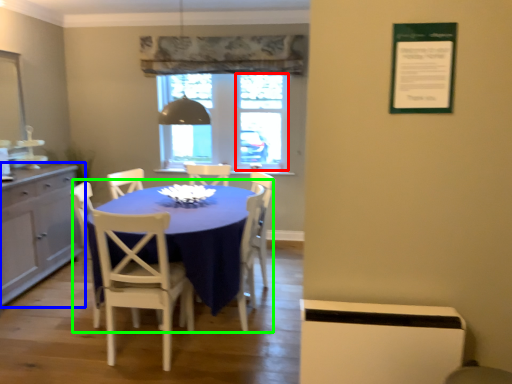
Question: Which object is the closest to the window screen (highlighted by a red box)? Choose among these: cabinetry (highlighted by a blue box) or kitchen & dining room table (highlighted by a green box).

Choices:
 (A) cabinetry
 (B) kitchen & dining room table

Answer: (B)